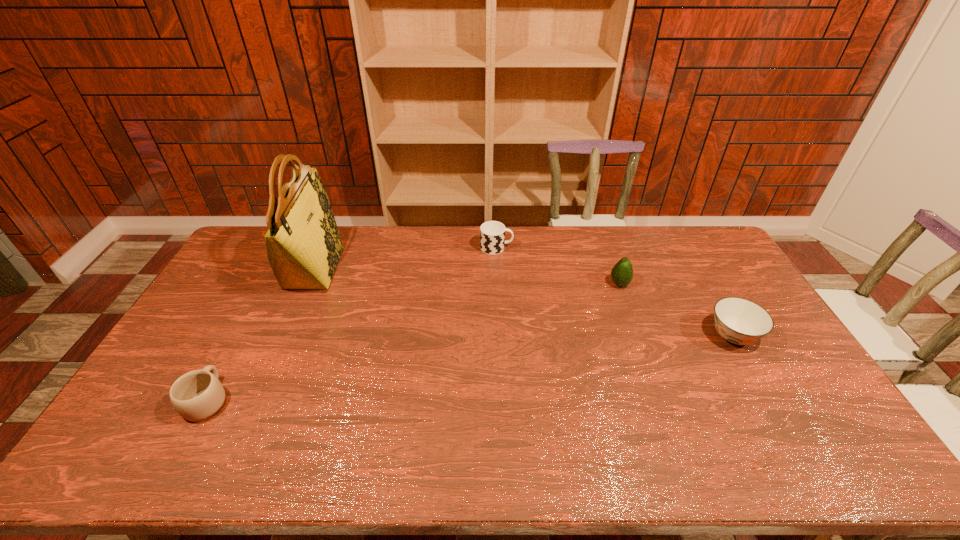
You are a GUI agent. You are given a task and a screenshot of the screen. Output one action in this format:
    pyautogui.click(x=<x>, y=<y>)
    Task: Click on the vacant space at the far left corner of the desktop
    The width and height of the screenshot is (960, 540).
    Given the screenshot: What is the action you would take?
    pyautogui.click(x=252, y=245)

Where is `free space at the far right corner of the desktop`? The image size is (960, 540). free space at the far right corner of the desktop is located at coordinates (675, 226).

You are a GUI agent. You are given a task and a screenshot of the screen. Output one action in this format:
    pyautogui.click(x=<x>, y=<y>)
    Task: Click on the vacant space at the near right corner
    This screenshot has height=540, width=960.
    Given the screenshot: What is the action you would take?
    pyautogui.click(x=795, y=442)

Find the location of a particular element. The width and height of the screenshot is (960, 540). free space between the tote bag and the third object from left to right is located at coordinates (405, 258).

Locate an element on the screen. The height and width of the screenshot is (540, 960). free space between the nearest object and the soup bowl is located at coordinates (470, 368).

The height and width of the screenshot is (540, 960). Find the location of `empty location between the second nearest object and the tallest object`. empty location between the second nearest object and the tallest object is located at coordinates (523, 302).

Locate an element on the screen. This screenshot has height=540, width=960. blank region between the nearest object and the cup is located at coordinates (352, 324).

Image resolution: width=960 pixels, height=540 pixels. Find the location of `empty space between the nearest object and the fourth object from left to right`. empty space between the nearest object and the fourth object from left to right is located at coordinates (414, 342).

The height and width of the screenshot is (540, 960). I want to click on vacant area that lies between the tallest object and the second nearest object, so click(x=523, y=302).

Find the location of a particular element. Image resolution: width=960 pixels, height=540 pixels. free space between the fourth object from left to right and the second nearest object is located at coordinates (676, 310).